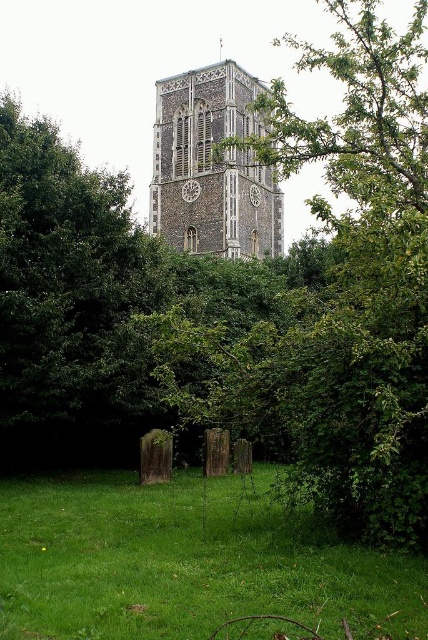
Question: Which object appears closest to the camera in this image?

Choices:
 (A) green leafy tree at center
 (B) stone clock tower at center

Answer: (A)

Question: Is green leafy tree at center closer to camera compared to stone clock tower at center?

Choices:
 (A) yes
 (B) no

Answer: (A)

Question: Which object appears closest to the camera in this image?

Choices:
 (A) stone clock tower at center
 (B) green grass at lower center

Answer: (B)

Question: Observing the image, what is the correct spatial positioning of green leafy tree at center in reference to stone clock tower at center?

Choices:
 (A) left
 (B) right

Answer: (B)

Question: Estimate the real-world distances between objects in this image. Which object is closer to the green grass at lower center?

Choices:
 (A) stone clock tower at center
 (B) green leafy tree at center

Answer: (B)

Question: Is green grass at lower center smaller than stone clock tower at center?

Choices:
 (A) yes
 (B) no

Answer: (A)